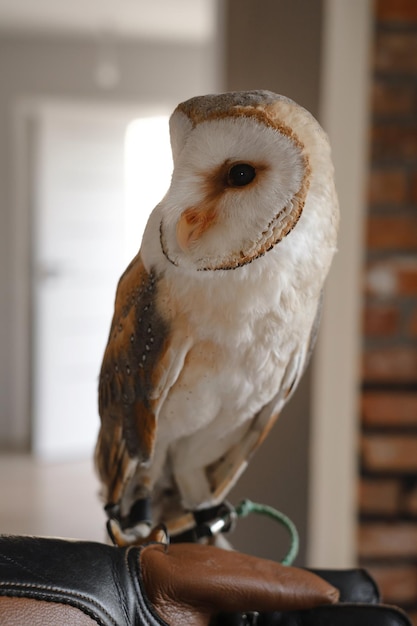
Image resolution: width=417 pixels, height=626 pixels. What are the coordinates of `lock` in the screenshot? It's located at (232, 515).